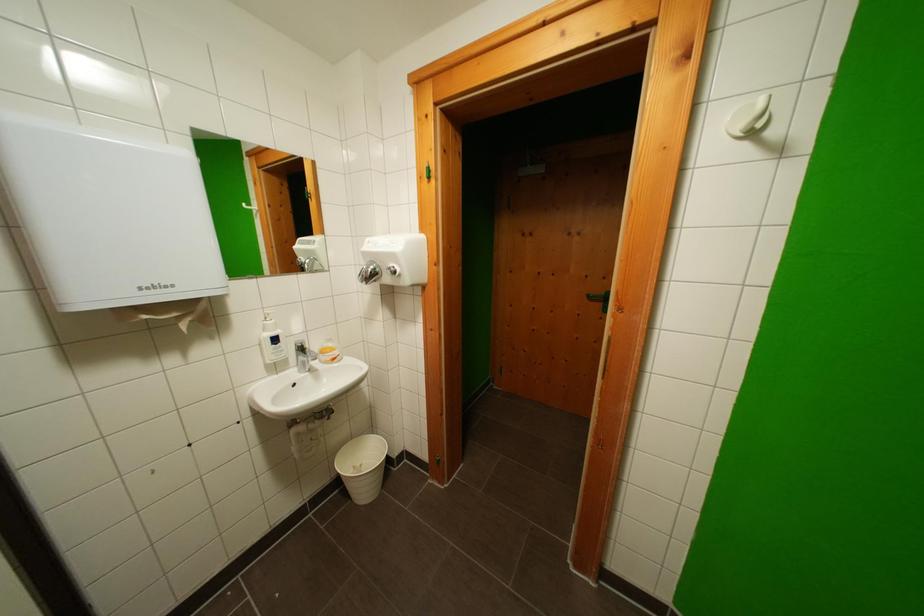
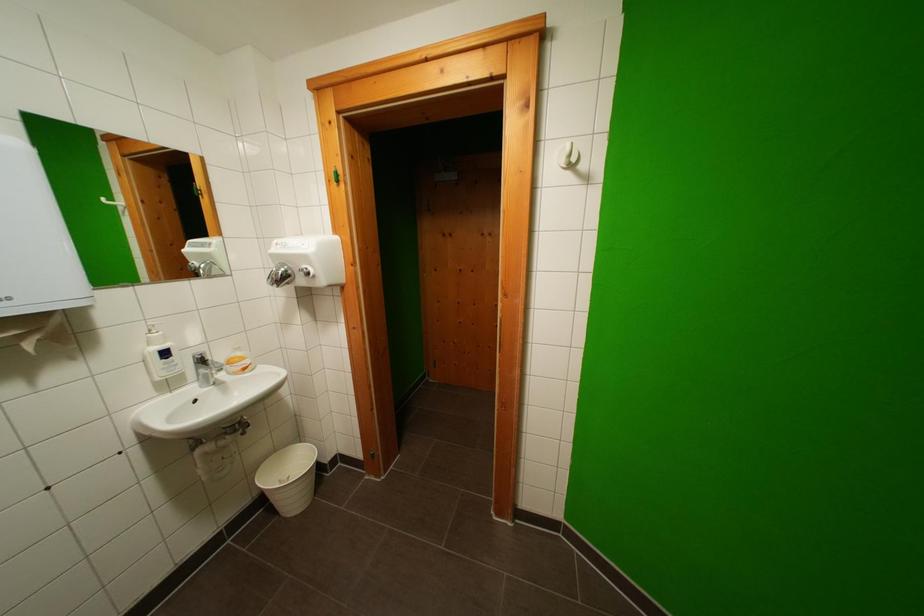
Where in the second image is the point corresponding to (x=203, y=304) from the first image?

(55, 317)